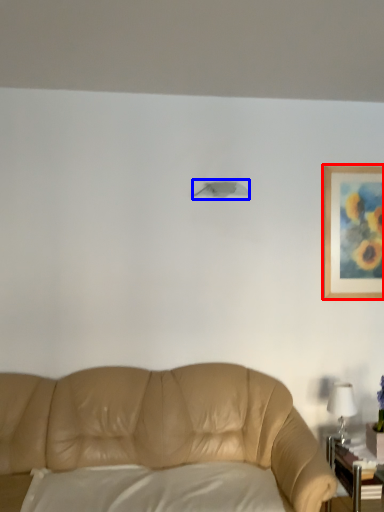
Question: Which object is closer to the camera taking this photo, picture frame (highlighted by a red box) or lamp (highlighted by a blue box)?

Choices:
 (A) picture frame
 (B) lamp

Answer: (B)